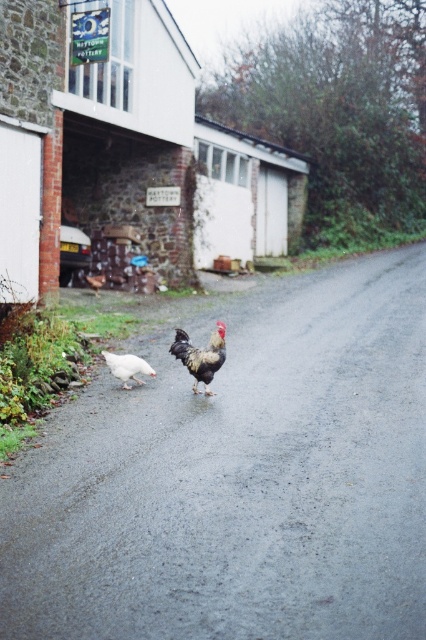
Does point (175, 340) lie in front of point (140, 381)?

That is True.

Who is more forward, (181,355) or (109,364)?

Point (181,355) is in front.

Find the location of a particular element. This screenshot has height=640, width=426. black glossy rooster at center is located at coordinates (201, 355).